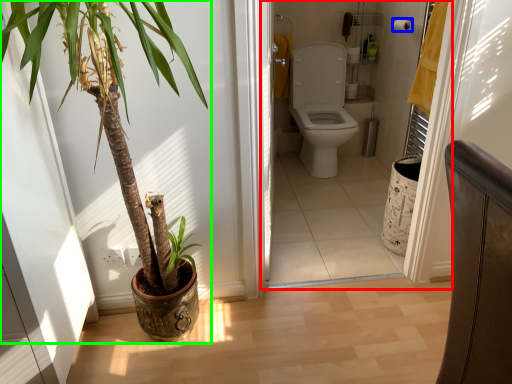
Question: Considering the real-world distances, which object is farthest from corridor (highlighted by a red box)? toilet paper (highlighted by a blue box) or houseplant (highlighted by a green box)?

Choices:
 (A) toilet paper
 (B) houseplant

Answer: (B)